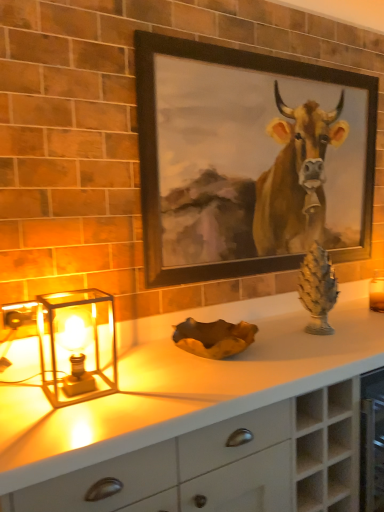
Question: Should I look upward or downward to see green stone pine cone at right?

Choices:
 (A) down
 (B) up

Answer: (A)

Question: Is white matte countertop at center located within green stone pine cone at right?

Choices:
 (A) no
 (B) yes

Answer: (A)

Question: Is green stone pine cone at right behind white matte countertop at center?

Choices:
 (A) yes
 (B) no

Answer: (A)

Question: From the image's perspective, would you say green stone pine cone at right is positioned over white matte countertop at center?

Choices:
 (A) yes
 (B) no

Answer: (A)

Question: Is the position of green stone pine cone at right less distant than that of white matte countertop at center?

Choices:
 (A) yes
 (B) no

Answer: (B)

Question: Does green stone pine cone at right have a greater width compared to white matte countertop at center?

Choices:
 (A) no
 (B) yes

Answer: (A)

Question: Is green stone pine cone at right at the right side of white matte countertop at center?

Choices:
 (A) no
 (B) yes

Answer: (B)

Question: From a real-world perspective, is translucent glass table lamp at left physically below white matte countertop at center?

Choices:
 (A) no
 (B) yes

Answer: (A)

Question: Is translucent glass table lamp at left further to camera compared to white matte countertop at center?

Choices:
 (A) no
 (B) yes

Answer: (B)

Question: Can you confirm if translucent glass table lamp at left is wider than white matte countertop at center?

Choices:
 (A) no
 (B) yes

Answer: (A)

Question: Is the position of translucent glass table lamp at left less distant than that of white matte countertop at center?

Choices:
 (A) yes
 (B) no

Answer: (B)

Question: Is translucent glass table lamp at left not within white matte countertop at center?

Choices:
 (A) no
 (B) yes

Answer: (B)

Question: Does translucent glass table lamp at left have a greater height compared to white matte countertop at center?

Choices:
 (A) no
 (B) yes

Answer: (A)

Question: From the image's perspective, is white matte countertop at center over translucent glass table lamp at left?

Choices:
 (A) no
 (B) yes

Answer: (A)